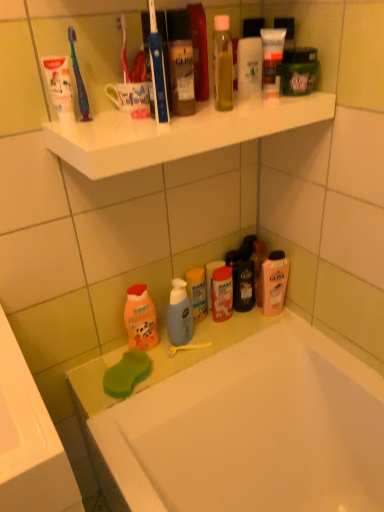
Where is `free region on the left part of white matte tube at upper center, positioned as the first toiletry in top-to-bottom order`? free region on the left part of white matte tube at upper center, positioned as the first toiletry in top-to-bottom order is located at coordinates (227, 113).